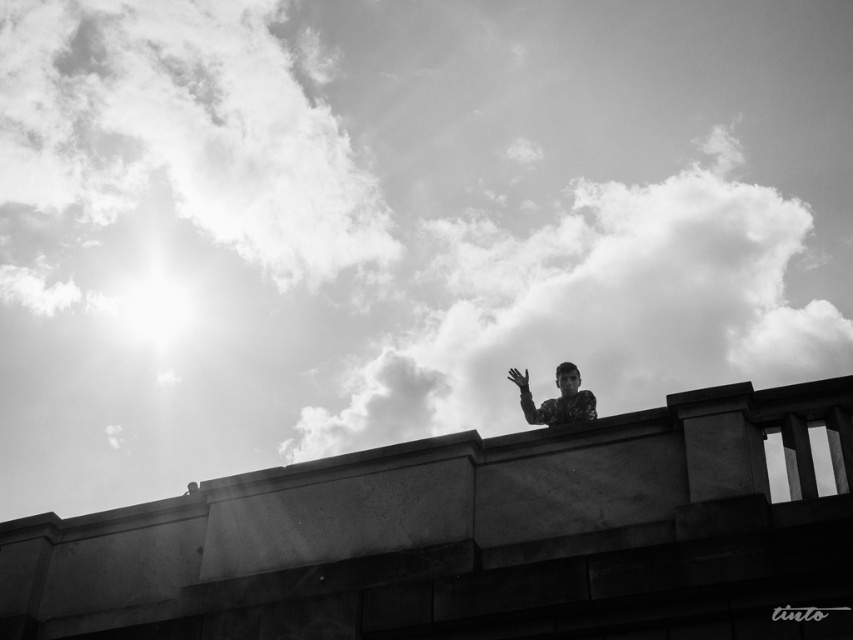
Question: Does camouflage fabric person at upper center appear over matte black hand at upper center?

Choices:
 (A) yes
 (B) no

Answer: (B)

Question: Is camouflage fabric person at upper center thinner than matte black hand at upper center?

Choices:
 (A) no
 (B) yes

Answer: (A)

Question: Is camouflage fabric person at upper center wider than matte black hand at upper center?

Choices:
 (A) no
 (B) yes

Answer: (B)

Question: Among these objects, which one is nearest to the camera?

Choices:
 (A) matte black hand at upper center
 (B) camouflage fabric person at upper center

Answer: (B)

Question: Which object appears farthest from the camera in this image?

Choices:
 (A) camouflage fabric person at upper center
 (B) matte black hand at upper center

Answer: (B)